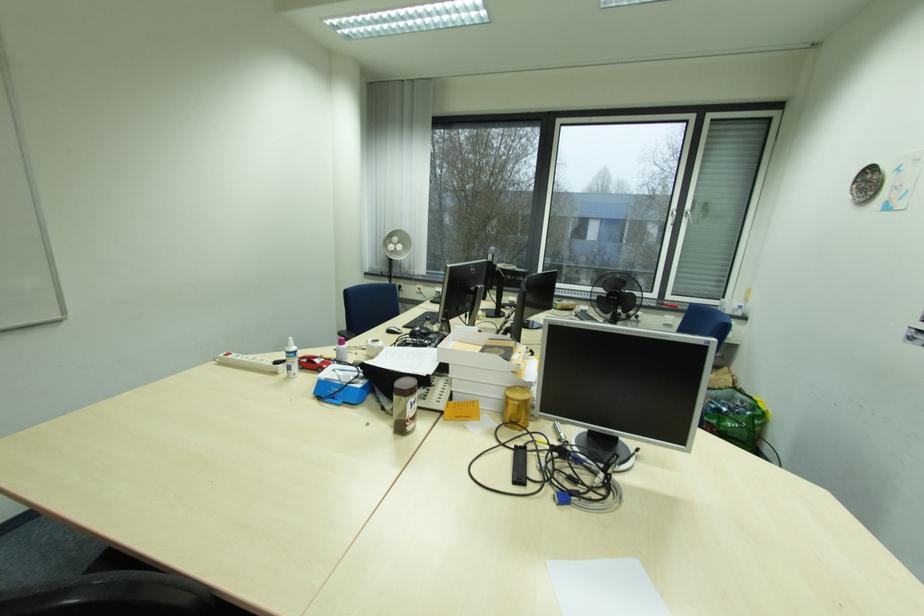
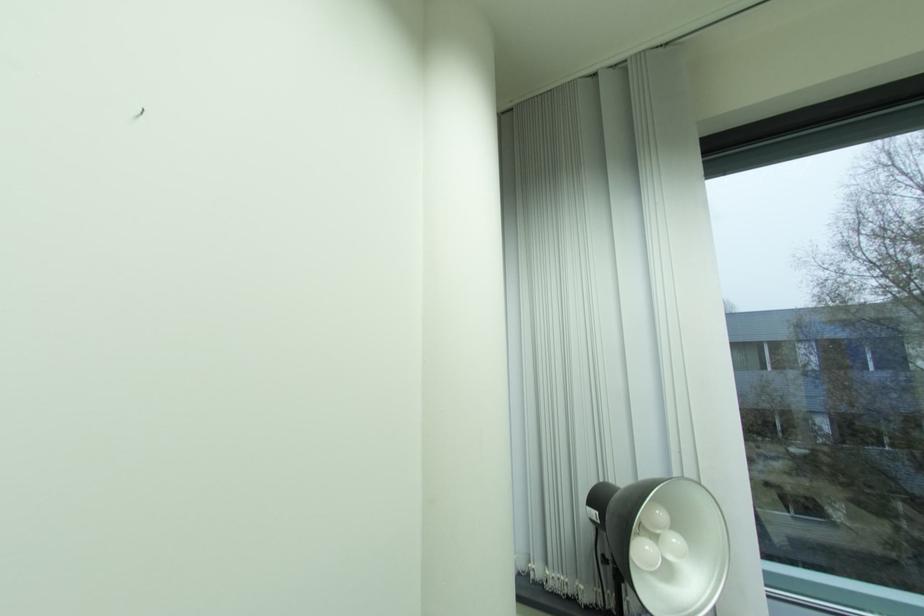
In the second image, find the point that corresponds to (403,243) in the first image.

(665, 531)